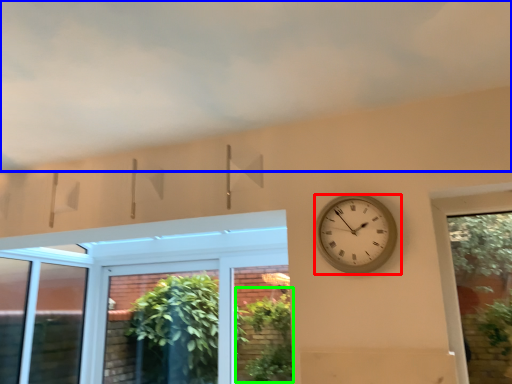
Question: Which is nearer to the wall clock (highlighted by a red box)? cloud (highlighted by a blue box) or plant (highlighted by a green box).

Choices:
 (A) cloud
 (B) plant

Answer: (A)